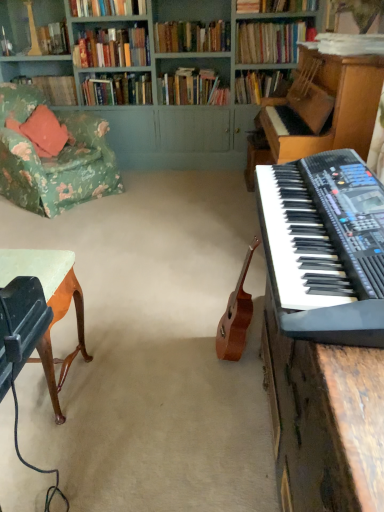
Question: Is white paper at upper right, the 10th book positioned from the back, taller or shorter than black plastic keyboard at right?

Choices:
 (A) tall
 (B) short

Answer: (B)

Question: Looking at their shapes, would you say white paper at upper right, the 10th book positioned from the back, is wider or thinner than black plastic keyboard at right?

Choices:
 (A) wide
 (B) thin

Answer: (B)

Question: Estimate the real-world distances between objects in this image. Which object is farther from the hardcover books at upper center, acting as the third book starting from the front?

Choices:
 (A) black plastic keyboard at right
 (B) hardcover books at upper center, which ranks as the ninth book in front-to-back order
 (C) white paper at upper right, the 1th book viewed from the front
 (D) hardcover book at upper left, arranged as the 1th book when viewed from the back
 (E) green painted wood bookcase at upper center

Answer: (A)

Question: Considering the real-world distances, which object is farthest from the wooden bookshelf at upper left?

Choices:
 (A) hardcover book at upper center, the second book when ordered from front to back
 (B) floral fabric armchair at left
 (C) hardcover books at upper center, which is the 8th book from back to front
 (D) hardcover books at upper left, which is the sixth book in front-to-back order
 (E) black plastic keyboard at right

Answer: (E)